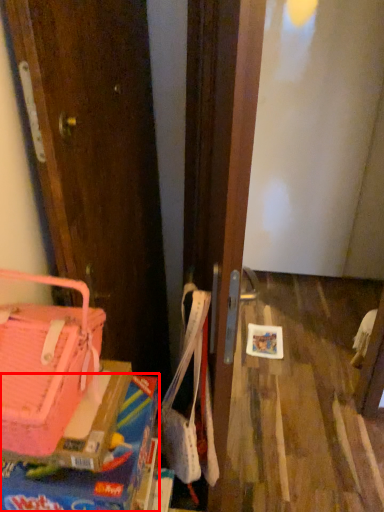
Question: Where is box (annotated by the red box) located in relation to handbag in the image?

Choices:
 (A) right
 (B) left

Answer: (A)